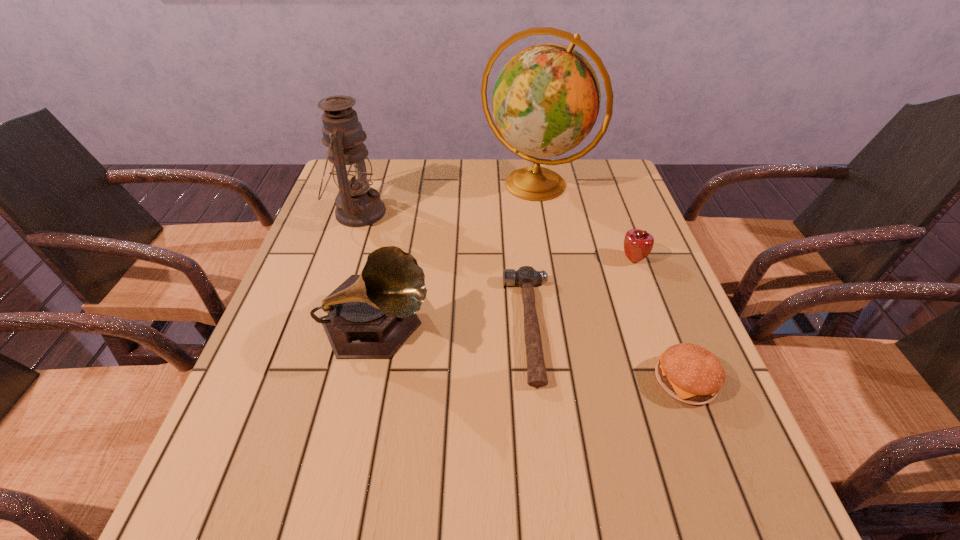
You are a GUI agent. You are given a task and a screenshot of the screen. Output one action in this format:
    pyautogui.click(x=<x>, y=<y>)
    Task: Click on the vacant area in the image that satisfies the following two spatial constraints: 1. on the horn direction of the phonograph record; 2. on the left side of the hamburger
    Image resolution: width=960 pixels, height=540 pixels.
    Given the screenshot: What is the action you would take?
    pyautogui.click(x=366, y=381)

The height and width of the screenshot is (540, 960). Find the location of `vacant region that satisfies the following two spatial constraints: 1. on the front side of the hamburger; 2. on the right side of the oil lamp`. vacant region that satisfies the following two spatial constraints: 1. on the front side of the hamburger; 2. on the right side of the oil lamp is located at coordinates (300, 381).

You are a GUI agent. You are given a task and a screenshot of the screen. Output one action in this format:
    pyautogui.click(x=<x>, y=<y>)
    Task: Click on the free point that satisfies the following two spatial constraints: 1. on the front side of the third farthest object; 2. on the left side of the oil lamp
    Image resolution: width=960 pixels, height=540 pixels.
    Given the screenshot: What is the action you would take?
    pyautogui.click(x=342, y=260)

Where is `free spot that satisfies the following two spatial constraints: 1. on the back side of the second shortest object; 2. on the horn direction of the fourth shortest object`? free spot that satisfies the following two spatial constraints: 1. on the back side of the second shortest object; 2. on the horn direction of the fourth shortest object is located at coordinates (666, 329).

Find the location of a particular element. This screenshot has width=960, height=540. free space that satisfies the following two spatial constraints: 1. on the back side of the hamburger; 2. on the horn direction of the third tallest object is located at coordinates (666, 329).

Locate an element on the screen. vacant space that satisfies the following two spatial constraints: 1. on the striking face of the shortest object; 2. on the left side of the second shortest object is located at coordinates (535, 381).